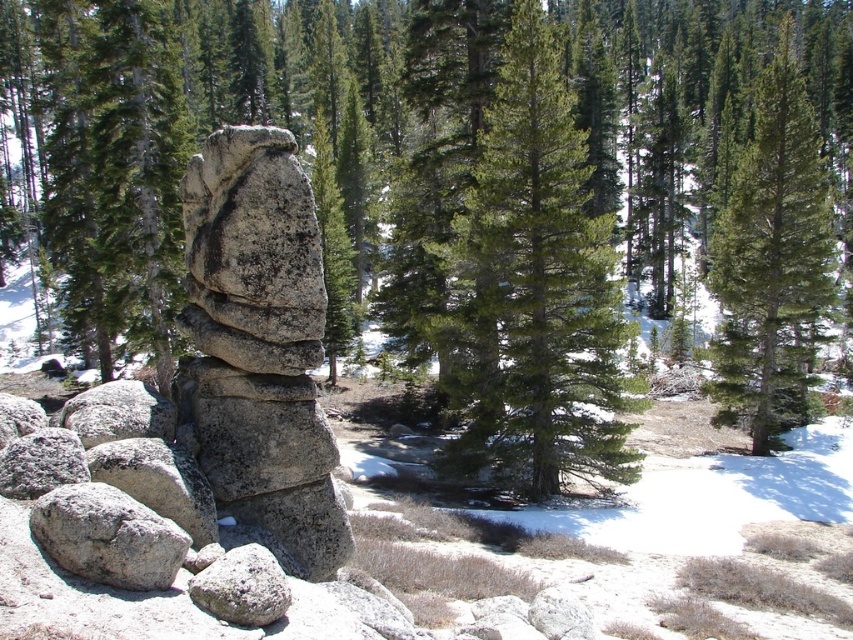
Question: Is green matte tree at center thinner than gray rough rock at center?

Choices:
 (A) no
 (B) yes

Answer: (A)

Question: Can you confirm if green matte tree at center is positioned above green matte tree at upper right?

Choices:
 (A) yes
 (B) no

Answer: (B)

Question: Considering the real-world distances, which object is farthest from the gray rough rock at center?

Choices:
 (A) green matte tree at upper right
 (B) green matte tree at center

Answer: (A)

Question: Which point appears farthest from the camera in this image?

Choices:
 (A) (729, 355)
 (B) (216, 467)

Answer: (A)

Question: Which object is positioned closest to the green matte tree at center?

Choices:
 (A) gray rough rock at center
 (B) green matte tree at upper right

Answer: (B)

Question: Where is green matte tree at center located in relation to gray rough rock at center in the image?

Choices:
 (A) right
 (B) left

Answer: (A)